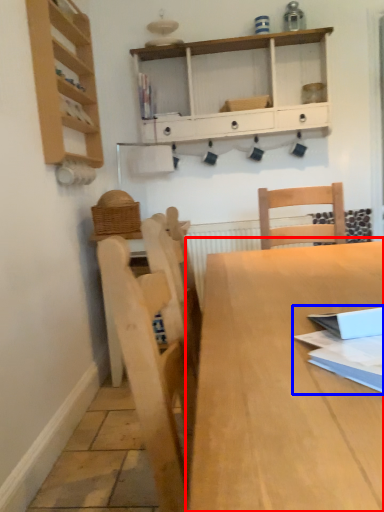
Question: Which of the following is the farthest to the observer, table (highlighted by a red box) or book (highlighted by a blue box)?

Choices:
 (A) table
 (B) book

Answer: (B)